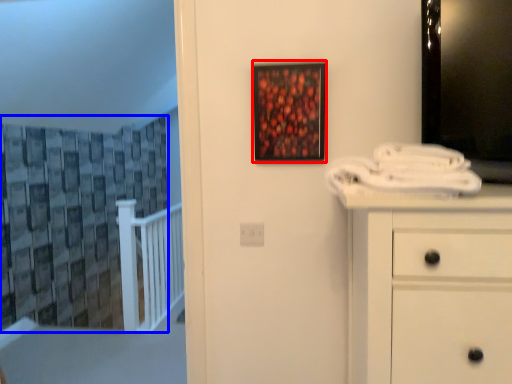
Question: Among these objects, which one is farthest to the camera, picture frame (highlighted by a red box) or curtain (highlighted by a blue box)?

Choices:
 (A) picture frame
 (B) curtain

Answer: (B)